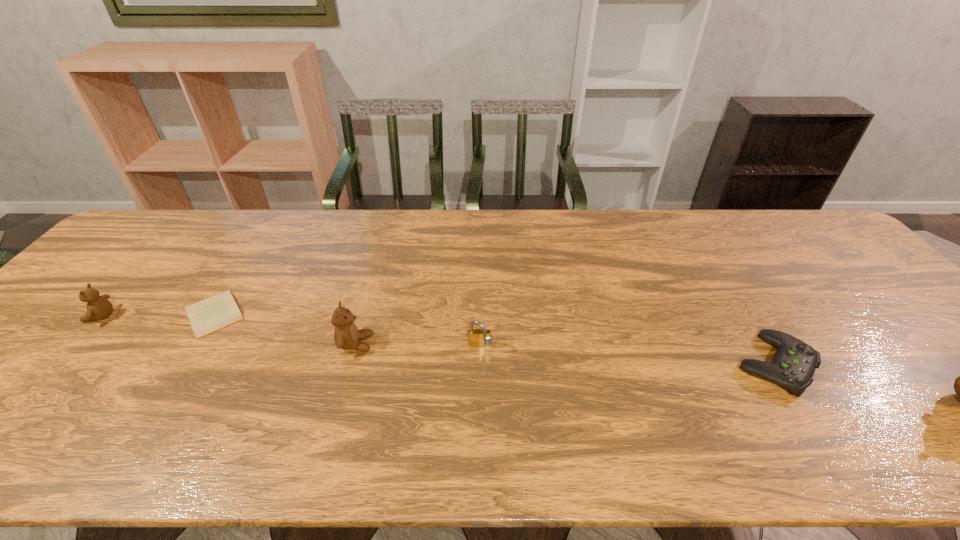
Identify the location of free area in between the shorter teddy bear and the fourth object from left to right. Image resolution: width=960 pixels, height=540 pixels. (290, 332).

Find the location of `free area in between the diary and the right teddy bear`. free area in between the diary and the right teddy bear is located at coordinates (285, 329).

Choose which object is the nearest neighbor to the shorter teddy bear. Please provide its 2D coordinates. Your answer should be formatted as a tuple, i.e. [(x, y)], where the tuple contains the x and y coordinates of a point satisfying the conditions above.

[(217, 312)]

Identify the location of object that is the third closest one to the leftmost object. The width and height of the screenshot is (960, 540). (479, 338).

You are a GUI agent. You are given a task and a screenshot of the screen. Output one action in this format:
    pyautogui.click(x=<x>, y=<y>)
    Task: Click on the teddy bear that is the second nearest to the fourth tallest object
    This screenshot has width=960, height=540.
    Given the screenshot: What is the action you would take?
    pyautogui.click(x=98, y=307)

This screenshot has height=540, width=960. Identify the location of blank area in the image that satisfies the following two spatial constraints: 1. on the front side of the diary; 2. on the front-facing side of the left teddy bear. (212, 316).

The width and height of the screenshot is (960, 540). In order to click on free region that satisfies the following two spatial constraints: 1. on the front side of the second shortest object; 2. on the right side of the second object from left to right in this screenshot , I will do `click(182, 364)`.